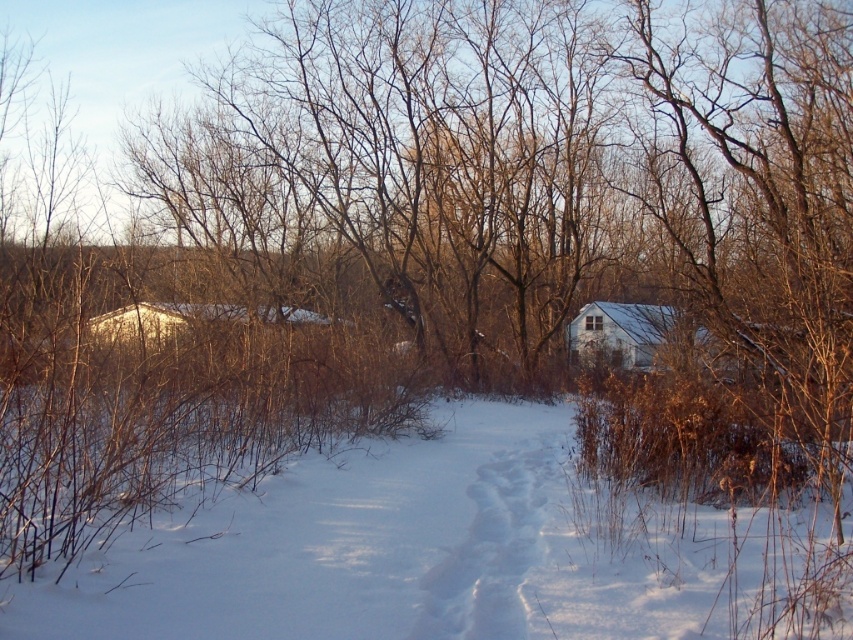
You are an architect designing a new winter village. You need to place a small wooden bench between the white powdery snow at center and the white matte house at center. Which object should the bench be closer to if you want it to be more visible to visitors approaching from the path?

The bench should be closer to the white matte house at center because it is shorter than the white powdery snow at center, making it more visible when placed near the lower object.

You are planning to build a snowman using the white powdery snow at center and want to place it near the white matte house at center. Based on their sizes, which one has a larger width?

The white powdery snow at center has a larger width than the white matte house at center.